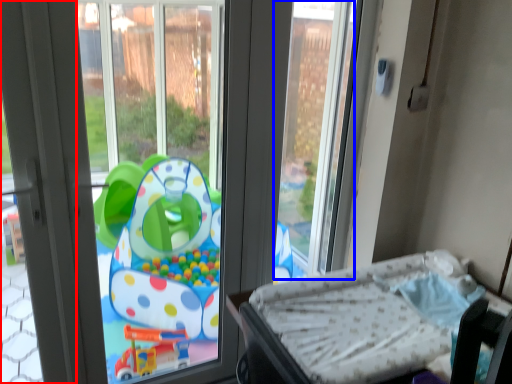
Question: Which of the following is the closest to the observer, screen door (highlighted by a red box) or window screen (highlighted by a blue box)?

Choices:
 (A) screen door
 (B) window screen

Answer: (A)